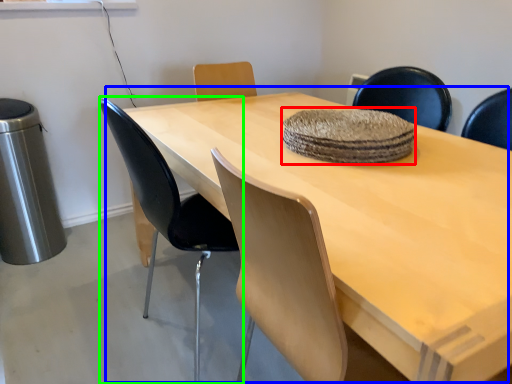
Question: Which object is positioned farthest from mat (highlighted by a red box)? Select from table (highlighted by a blue box) and chair (highlighted by a green box).

Choices:
 (A) table
 (B) chair

Answer: (B)